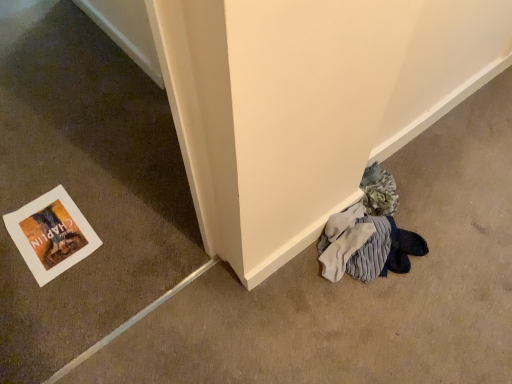
Image resolution: width=512 pixels, height=384 pixels. Identify the location of white paper at lower left. (85, 185).

What do you see at coordinates (85, 185) in the screenshot? The image size is (512, 384). I see `white paper at lower left` at bounding box center [85, 185].

What is the approximate height of white paper at lower left?

white paper at lower left is 92.03 centimeters in height.

Describe the element at coordinates (51, 234) in the screenshot. I see `white paper at lower left` at that location.

Locate an element on the screen. This screenshot has width=512, height=384. white paper at lower left is located at coordinates (51, 234).

Identify the location of white paper at lower left. Image resolution: width=512 pixels, height=384 pixels. (85, 185).

Considering the relative positions of white paper at lower left and white paper at lower left in the image provided, is white paper at lower left to the left or to the right of white paper at lower left?

Clearly, white paper at lower left is on the left of white paper at lower left in the image.

Does white paper at lower left lie in front of white paper at lower left?

No, white paper at lower left is further to the viewer.

Which is more distant, [41,282] or [34,97]?

The point [34,97] is farther.

From the image's perspective, is white paper at lower left over white paper at lower left?

Indeed, from the image's perspective, white paper at lower left is shown above white paper at lower left.

From a real-world perspective, between white paper at lower left and white paper at lower left, who is vertically higher?

In real-world perspective, white paper at lower left is above.

Considering the relative sizes of white paper at lower left and white paper at lower left in the image provided, is white paper at lower left thinner than white paper at lower left?

Incorrect, the width of white paper at lower left is not less than that of white paper at lower left.

Considering the sizes of white paper at lower left and white paper at lower left in the image, is white paper at lower left taller or shorter than white paper at lower left?

In the image, white paper at lower left appears to be shorter than white paper at lower left.

Considering the sizes of objects white paper at lower left and white paper at lower left in the image provided, who is bigger, white paper at lower left or white paper at lower left?

white paper at lower left is bigger.

Which is correct: white paper at lower left is inside white paper at lower left, or outside of it?

white paper at lower left exists outside the volume of white paper at lower left.

Does white paper at lower left touch white paper at lower left?

No.

Could you tell me if white paper at lower left is turned towards white paper at lower left?

Yes, white paper at lower left is aimed at white paper at lower left.

Can you tell me how much white paper at lower left and white paper at lower left differ in facing direction?

The angular difference between white paper at lower left and white paper at lower left is 179 degrees.

How much distance is there between white paper at lower left and white paper at lower left?

white paper at lower left is 7.43 inches from white paper at lower left.

Identify the location of picture frame below the white paper at lower left (from a real-world perspective). (51, 234).

Which object is positioned more to the left, white paper at lower left or white paper at lower left?

Positioned to the left is white paper at lower left.

Does white paper at lower left lie in front of white paper at lower left?

Yes, white paper at lower left is in front of white paper at lower left.

Considering the points (115, 200) and (59, 227), which point is in front, point (115, 200) or point (59, 227)?

The point (59, 227) is in front.

From the image's perspective, is white paper at lower left on white paper at lower left?

No.

From a real-world perspective, who is located lower, white paper at lower left or white paper at lower left?

From a 3D spatial view, white paper at lower left is below.

Looking at this image, can you confirm if white paper at lower left is thinner than white paper at lower left?

Yes, white paper at lower left is thinner than white paper at lower left.

Considering the sizes of objects white paper at lower left and white paper at lower left in the image provided, who is shorter, white paper at lower left or white paper at lower left?

white paper at lower left is shorter.

Is white paper at lower left bigger than white paper at lower left?

Yes.

Do you think white paper at lower left is within white paper at lower left, or outside of it?

white paper at lower left is spatially situated outside white paper at lower left.

Would you say white paper at lower left is a long distance from white paper at lower left?

No.

Is white paper at lower left oriented away from white paper at lower left?

No, white paper at lower left is not facing the opposite direction of white paper at lower left.

In the image, there is a white paper at lower left. At what (x,y) coordinates should I click in order to perform the action: click on picture frame below it (from a real-world perspective). Please return your answer as a coordinate pair (x, y). This screenshot has width=512, height=384. Looking at the image, I should click on (51, 234).

Identify the location of concrete below the white paper at lower left (from the image's perspective). (85, 185).

This screenshot has width=512, height=384. I want to click on picture frame that appears behind the white paper at lower left, so click(x=51, y=234).